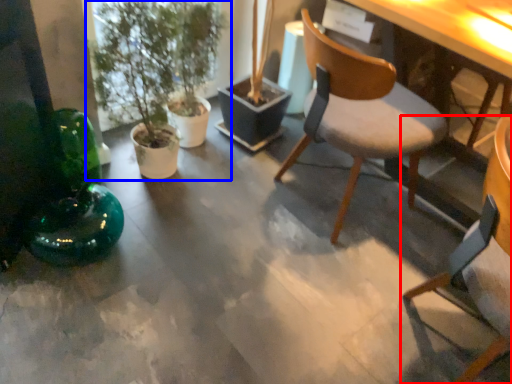
Question: Among these objects, which one is farthest to the camera, chair (highlighted by a red box) or houseplant (highlighted by a blue box)?

Choices:
 (A) chair
 (B) houseplant

Answer: (B)